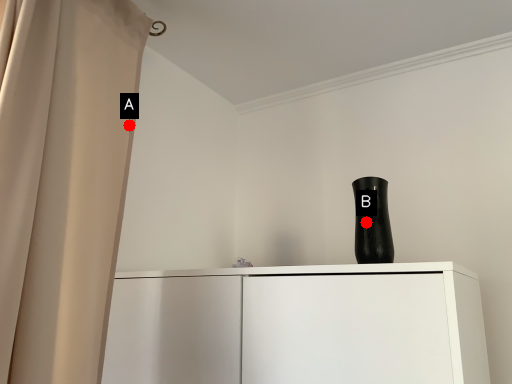
Question: Two points are circled on the image, labeled by A and B beside each circle. Which point is farther from the camera taking this photo?

Choices:
 (A) A is further
 (B) B is further

Answer: (A)